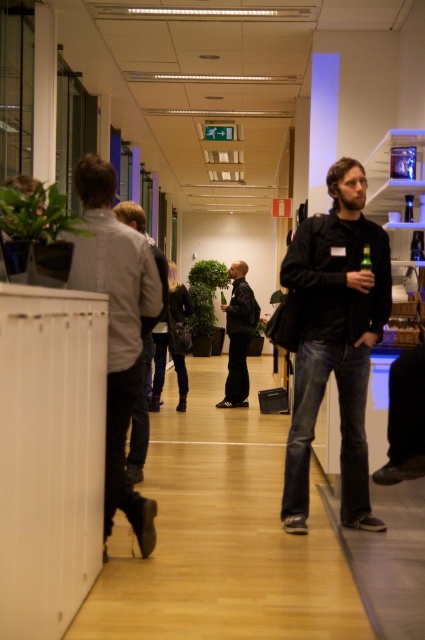
Question: Can you confirm if matte black jacket at center is positioned below light gray fabric jacket at left?

Choices:
 (A) no
 (B) yes

Answer: (A)

Question: Is light gray fabric jacket at left wider than green glass bottle at center?

Choices:
 (A) no
 (B) yes

Answer: (B)

Question: Among these points, which one is nearest to the camera?

Choices:
 (A) (113, 392)
 (B) (234, 308)
 (C) (367, 253)
 (D) (388, 275)

Answer: (A)

Question: Estimate the real-world distances between objects in this image. Which object is farther from the green glass bottle at center?

Choices:
 (A) light gray fabric jacket at left
 (B) dark blue leather jacket at center
 (C) matte black jacket at center

Answer: (B)

Question: Is matte black jacket at center bigger than light gray fabric jacket at left?

Choices:
 (A) no
 (B) yes

Answer: (A)

Question: Which of these objects is positioned closest to the light gray fabric jacket at left?

Choices:
 (A) matte black jacket at center
 (B) dark blue leather jacket at center

Answer: (A)